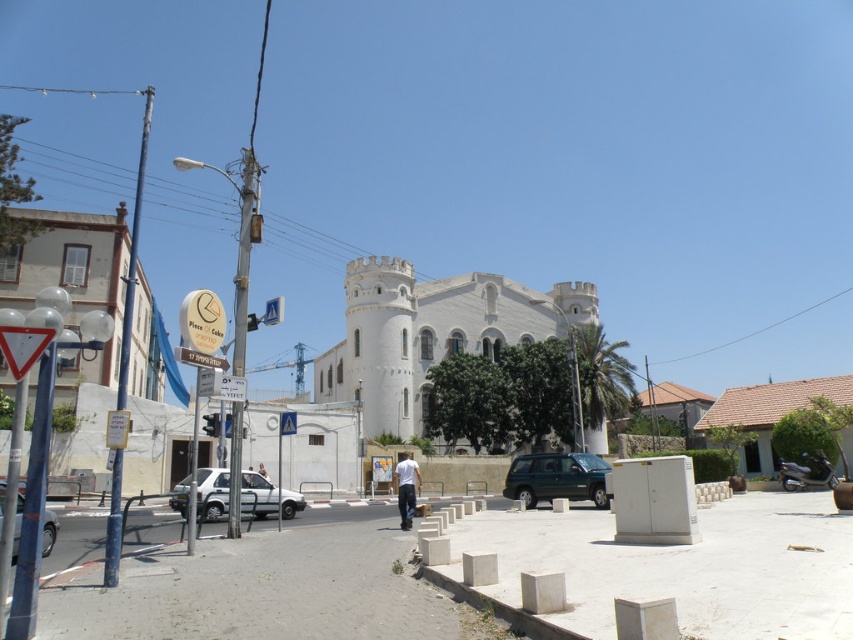
Can you confirm if white cotton shirt at center is wider than metallic silver car at lower left?

In fact, white cotton shirt at center might be narrower than metallic silver car at lower left.

Between white cotton shirt at center and metallic silver car at lower left, which one is positioned higher?

metallic silver car at lower left is higher up.

The image size is (853, 640). What are the coordinates of `white cotton shirt at center` in the screenshot? It's located at (405, 486).

Describe the element at coordinates (556, 477) in the screenshot. I see `green matte suv at center` at that location.

Can you confirm if green matte suv at center is positioned above white plastic sign at left?

No, green matte suv at center is not above white plastic sign at left.

You are a GUI agent. You are given a task and a screenshot of the screen. Output one action in this format:
    pyautogui.click(x=<x>, y=<y>)
    Task: Click on the green matte suv at center
    This screenshot has width=853, height=640.
    Given the screenshot: What is the action you would take?
    pyautogui.click(x=556, y=477)

How much distance is there between white matte car at lower left and metallic silver car at lower left?

white matte car at lower left is 13.48 meters away from metallic silver car at lower left.

Is white matte car at lower left positioned in front of metallic silver car at lower left?

No, white matte car at lower left is behind metallic silver car at lower left.

What do you see at coordinates (267, 497) in the screenshot?
I see `white matte car at lower left` at bounding box center [267, 497].

Identify the location of white matte car at lower left. (267, 497).